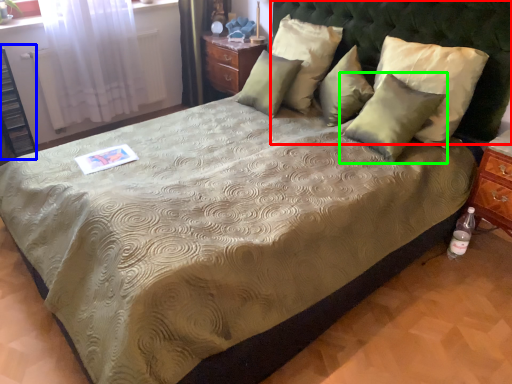
Question: Which is farther away from headboard (highlighted by a red box)? dresser (highlighted by a blue box) or pillow (highlighted by a green box)?

Choices:
 (A) dresser
 (B) pillow

Answer: (A)